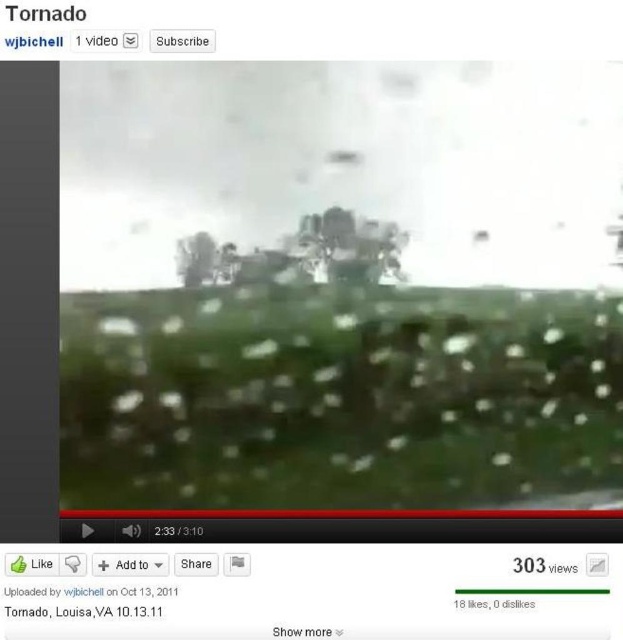
In the scene shown: You are a weather observer analyzing the tornado scene. You notice the green leafy tree at center and the transparent text at center. Which object is positioned higher in the image?

The green leafy tree at center is positioned higher than the transparent text at center in the image.

You are a storm chaser who just arrived at the scene of the tornado. You see the green leafy tree at center and the transparent text at center. Which object is taller?

The green leafy tree at center is much taller than the transparent text at center.